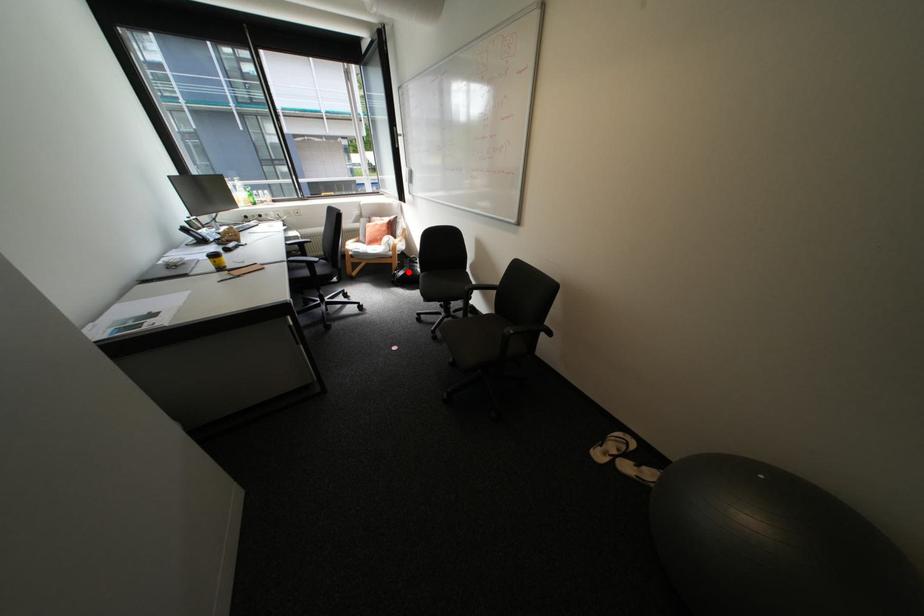
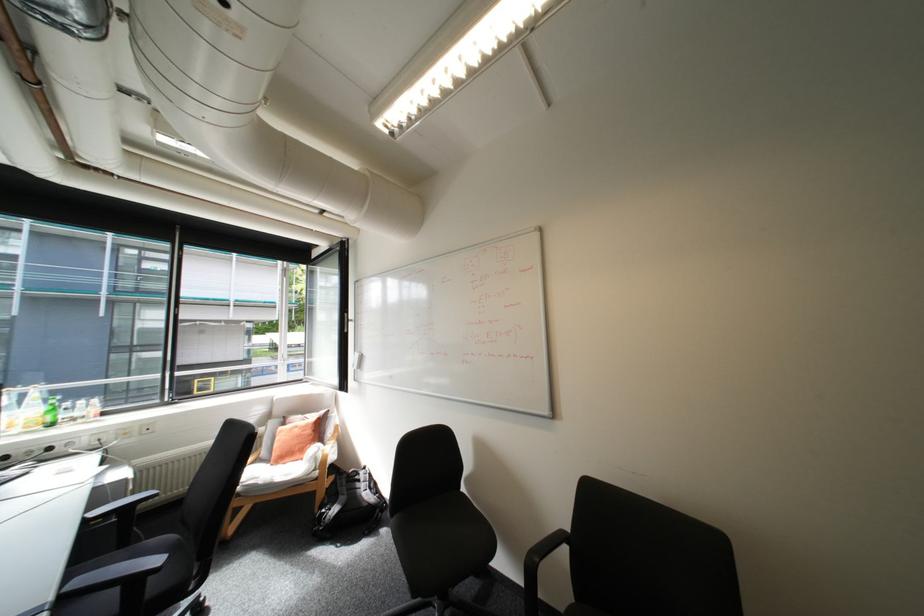
Question: I am providing you with two images of the same scene from different viewpoints. In image1, a red point is highlighted. Considering the same 3D point in image2, which of the following is correct?

Choices:
 (A) It is closer
 (B) It is farther

Answer: (A)